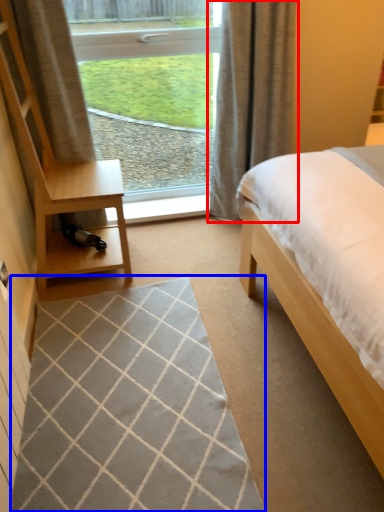
Question: Which point is further to the camera, curtain (highlighted by a red box) or mat (highlighted by a blue box)?

Choices:
 (A) curtain
 (B) mat

Answer: (A)